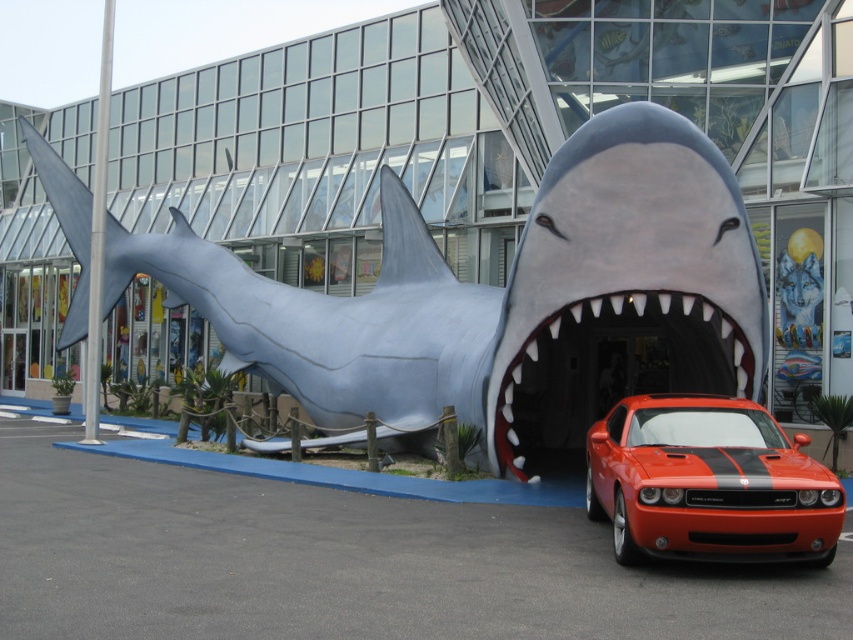
From the picture: You are standing in front of a modern glass building and see the gray matte shark at center. If you want to take a photo of the shark sculpture without including the modern glass building behind it, how far back should you move from your current position?

You should move back to a distance of 10.36 meters from the gray matte shark at center to ensure the modern glass building is no longer in the frame.

You are a photographer trying to capture both the orange glossy car at center and the white teeth plastic mouth at center in a single shot. Based on their positions, which object should you focus on first to ensure both are in frame?

The orange glossy car at center is located above the white teeth plastic mouth at center, so you should focus on the white teeth plastic mouth at center first to ensure both are in frame.

You are standing at the point marked by the coordinate point (x=492, y=289) in the scene. Looking around, you see the gray matte shark at center. What object is located exactly at your current position?

The point (x=492, y=289) marks the gray matte shark at center.